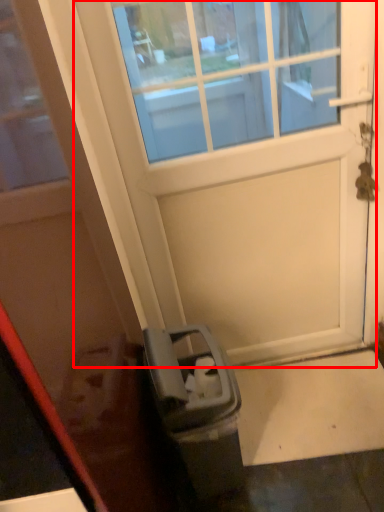
Question: Observing the image, what is the correct spatial positioning of door (annotated by the red box) in reference to door?

Choices:
 (A) left
 (B) right

Answer: (B)